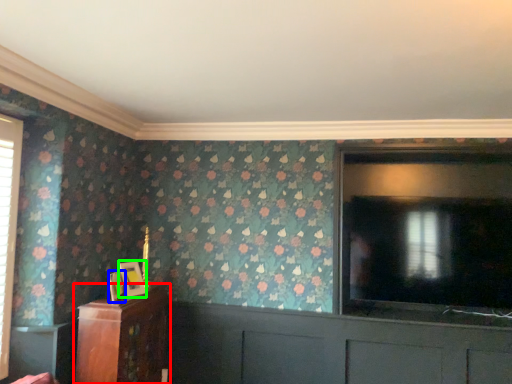
Question: Which object is positioned closest to furniture (highlighted by a red box)? Select from picture frame (highlighted by a blue box) and picture frame (highlighted by a green box).

Choices:
 (A) picture frame
 (B) picture frame

Answer: (B)